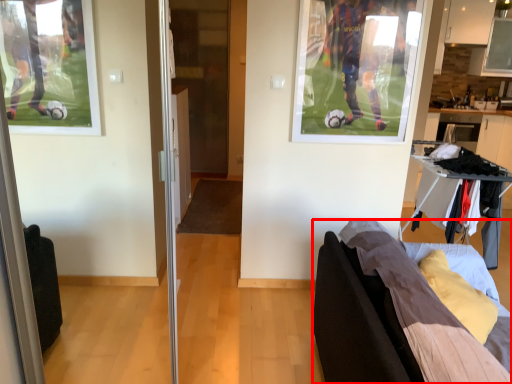
Question: Observing the image, what is the correct spatial positioning of furniture (annotated by the red box) in reference to screen door?

Choices:
 (A) left
 (B) right

Answer: (B)